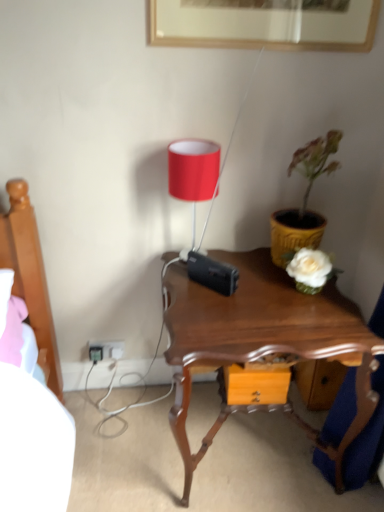
Locate an element on the screen. free spot to the right of matte red lampshade at upper center is located at coordinates (248, 269).